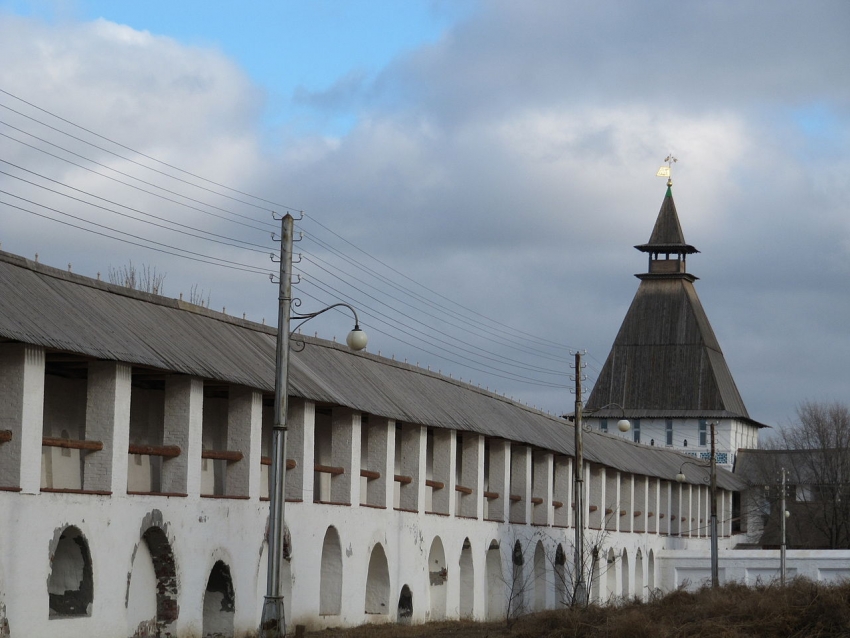
This screenshot has width=850, height=638. What are the coordinates of `white wall` in the screenshot? It's located at (688, 570), (746, 561), (819, 566).